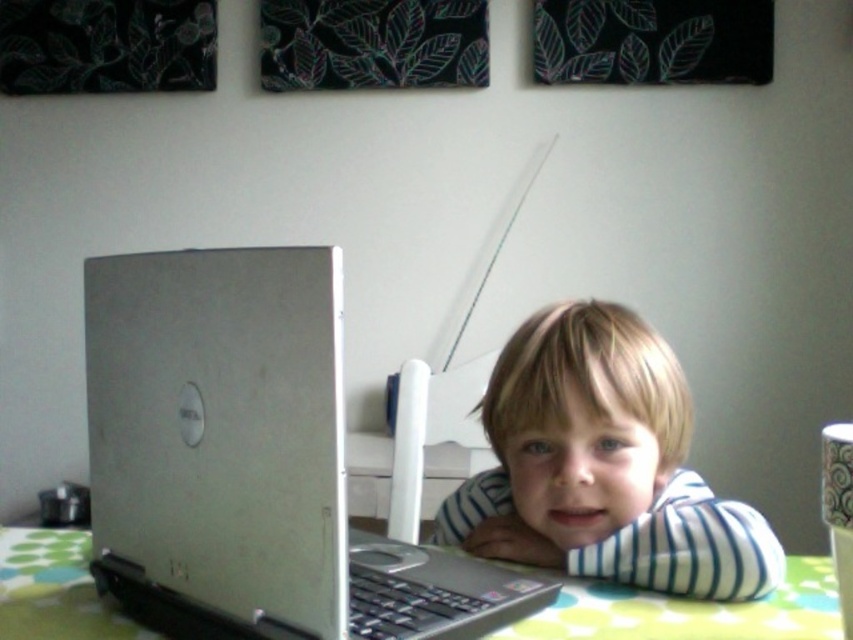
Does silver metallic laptop at center have a greater width compared to green dotted fabric at lower center?

Correct, the width of silver metallic laptop at center exceeds that of green dotted fabric at lower center.

Is the position of silver metallic laptop at center less distant than that of green dotted fabric at lower center?

Yes, silver metallic laptop at center is closer to the viewer.

Find the location of `silver metallic laptop at center`. silver metallic laptop at center is located at coordinates (248, 461).

Which is above, blonde hair at center or green dotted fabric at lower center?

Positioned higher is blonde hair at center.

Does point (532, 490) come in front of point (798, 589)?

No, (532, 490) is behind (798, 589).

Does point (579, 369) come in front of point (45, 608)?

That is False.

The width and height of the screenshot is (853, 640). In order to click on blonde hair at center in this screenshot , I will do (x=602, y=465).

Is point (270, 298) positioned after point (498, 556)?

No, (270, 298) is closer to viewer.

Is silver metallic laptop at center positioned in front of blonde hair at center?

Yes, silver metallic laptop at center is in front of blonde hair at center.

Locate an element on the screen. silver metallic laptop at center is located at coordinates (248, 461).